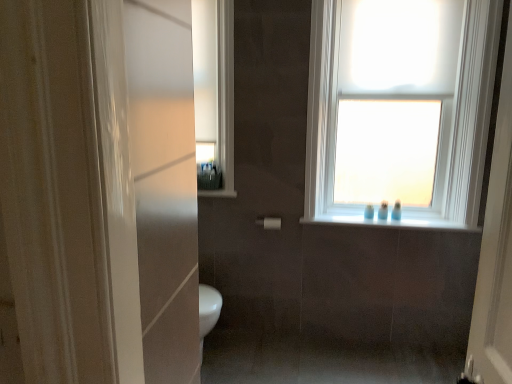
Locate an element on the screen. free spot in front of blue glossy toothbrush at upper right, placed as the first toiletry when sorted from right to left is located at coordinates (402, 221).